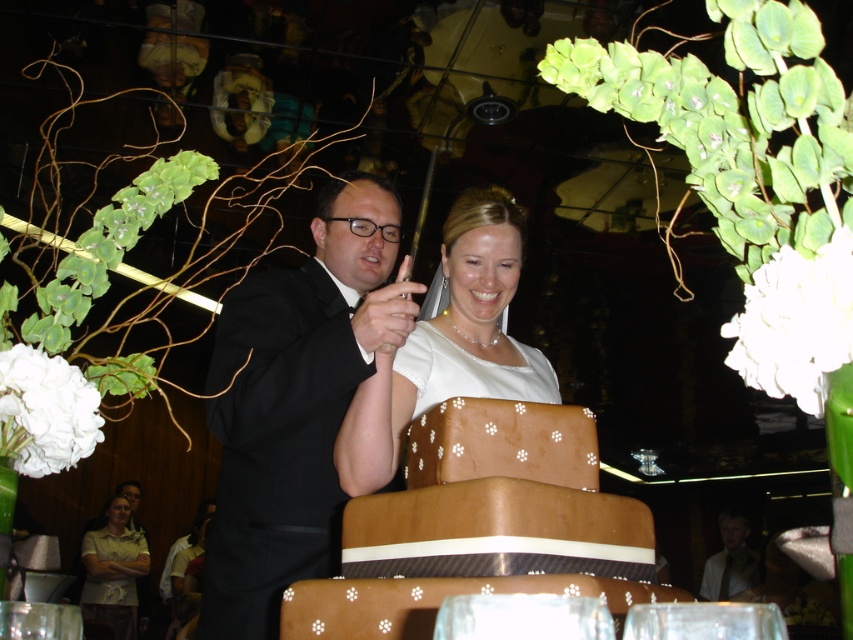
Question: Which is nearer to the brown textured cake at center?

Choices:
 (A) white satin dress at center
 (B) black satin tuxedo at center

Answer: (A)

Question: In this image, where is black satin tuxedo at center located relative to brown textured cake at center?

Choices:
 (A) above
 (B) below

Answer: (A)

Question: Can you confirm if brown textured cake at center is wider than white satin dress at center?

Choices:
 (A) yes
 (B) no

Answer: (A)

Question: Which of these objects is positioned closest to the white satin dress at center?

Choices:
 (A) brown textured cake at center
 (B) black satin tuxedo at center

Answer: (B)

Question: Which point is farther to the camera?

Choices:
 (A) (529, 588)
 (B) (402, 412)

Answer: (B)

Question: Is brown textured cake at center thinner than white satin dress at center?

Choices:
 (A) yes
 (B) no

Answer: (B)